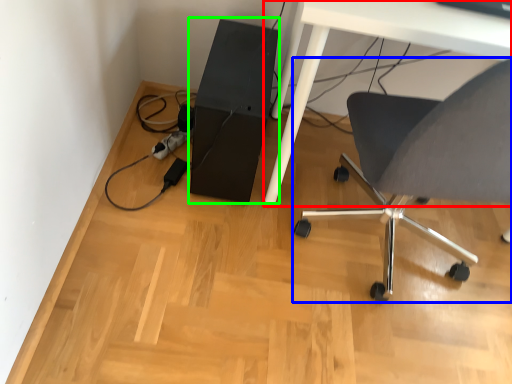
Question: Which object is the closest to the table (highlighted by a red box)? Choose among these: chair (highlighted by a blue box) or computer tower (highlighted by a green box).

Choices:
 (A) chair
 (B) computer tower

Answer: (B)